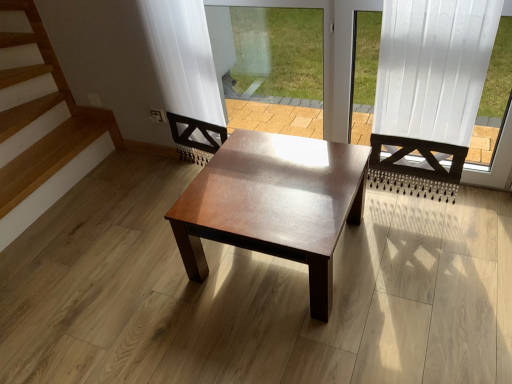
Where is `free space in front of white wood frame at upper right`? This screenshot has height=384, width=512. free space in front of white wood frame at upper right is located at coordinates (422, 289).